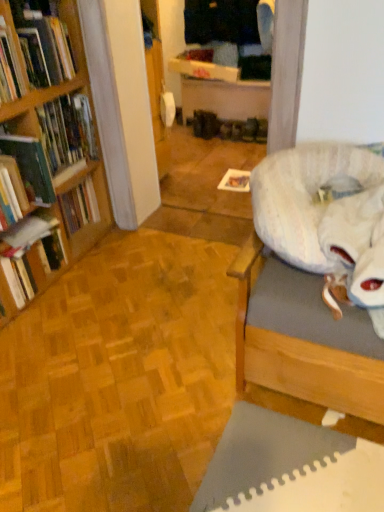
Question: Is hardcover book at left, positioned as the first book in bottom-to-top order, closer to the viewer compared to hardcover book at left, positioned as the second book in bottom-to-top order?

Choices:
 (A) yes
 (B) no

Answer: (B)

Question: Is hardcover book at left, acting as the fourth book starting from the top, bigger than hardcover book at left, positioned as the second book in bottom-to-top order?

Choices:
 (A) yes
 (B) no

Answer: (B)

Question: From a real-world perspective, is hardcover book at left, acting as the fourth book starting from the top, positioned under hardcover book at left, positioned as the second book in bottom-to-top order, based on gravity?

Choices:
 (A) no
 (B) yes

Answer: (B)

Question: Does hardcover book at left, acting as the fourth book starting from the top, appear on the left side of hardcover book at left, the 3th book positioned from the top?

Choices:
 (A) yes
 (B) no

Answer: (A)

Question: Considering the relative sizes of hardcover book at left, acting as the fourth book starting from the top, and hardcover book at left, the 3th book positioned from the top, in the image provided, is hardcover book at left, acting as the fourth book starting from the top, smaller than hardcover book at left, the 3th book positioned from the top,?

Choices:
 (A) no
 (B) yes

Answer: (B)

Question: Does point (259, 181) appear closer or farther from the camera than point (254, 129)?

Choices:
 (A) closer
 (B) farther

Answer: (A)

Question: Would you say fluffy white bean bag at right is to the left or to the right of matte brown shoe at center in the picture?

Choices:
 (A) left
 (B) right

Answer: (A)

Question: Which is correct: fluffy white bean bag at right is inside matte brown shoe at center, or outside of it?

Choices:
 (A) inside
 (B) outside

Answer: (B)

Question: From the image's perspective, is fluffy white bean bag at right positioned above or below matte brown shoe at center?

Choices:
 (A) above
 (B) below

Answer: (B)

Question: Would you say hardcover book at left, positioned as the second book in bottom-to-top order, is to the left or to the right of wooden bookshelf at left, the 4th book positioned from the bottom, in the picture?

Choices:
 (A) right
 (B) left

Answer: (B)

Question: Considering the positions of hardcover book at left, positioned as the second book in bottom-to-top order, and wooden bookshelf at left, which is the first book from top to bottom, in the image, is hardcover book at left, positioned as the second book in bottom-to-top order, taller or shorter than wooden bookshelf at left, which is the first book from top to bottom,?

Choices:
 (A) tall
 (B) short

Answer: (B)

Question: From the image's perspective, relative to wooden bookshelf at left, the 4th book positioned from the bottom, is hardcover book at left, positioned as the second book in bottom-to-top order, above or below?

Choices:
 (A) below
 (B) above

Answer: (A)

Question: In the image, is hardcover book at left, the 3th book positioned from the top, positioned in front of or behind wooden bookshelf at left, which is the first book from top to bottom?

Choices:
 (A) front
 (B) behind

Answer: (A)

Question: Looking at their shapes, would you say wooden bookshelf at left, which is the first book from top to bottom, is wider or thinner than hardcover book at left, acting as the fourth book starting from the top?

Choices:
 (A) thin
 (B) wide

Answer: (B)

Question: Considering their positions, is wooden bookshelf at left, which is the first book from top to bottom, located in front of or behind hardcover book at left, positioned as the first book in bottom-to-top order?

Choices:
 (A) front
 (B) behind

Answer: (A)